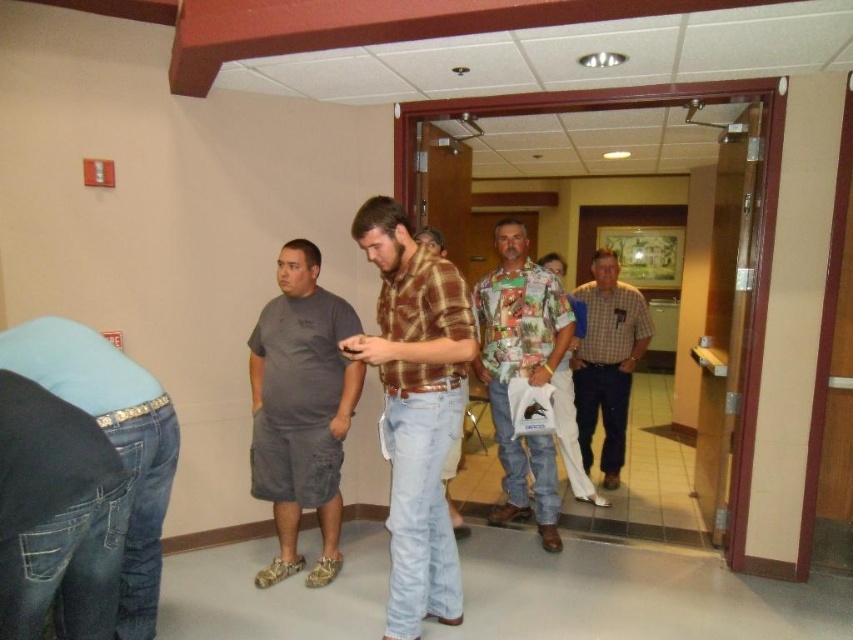
From the picture: You are organizing a clothing display and need to arrange the printed fabric shirt at center and the floral shirt at center side by side. Given their sizes, which shirt should be placed on the left to ensure they fit within the display area without overlapping?

The printed fabric shirt at center should be placed on the left since it has a larger width than the floral shirt at center, allowing both to fit side by side without overlapping.

You are organizing a clothing display and need to arrange the brown plaid shirt at center and the printed fabric shirt at center. Which shirt should you place in a larger display area to accommodate its size?

The printed fabric shirt at center requires a larger display area because it occupies more space than the brown plaid shirt at center according to the description.

You are observing the group in the hallway. Which of the two shirts at the center is closer to you, the brown plaid shirt at center or the printed fabric shirt at center?

The brown plaid shirt at center is closer to you as it is in front of the printed fabric shirt at center.